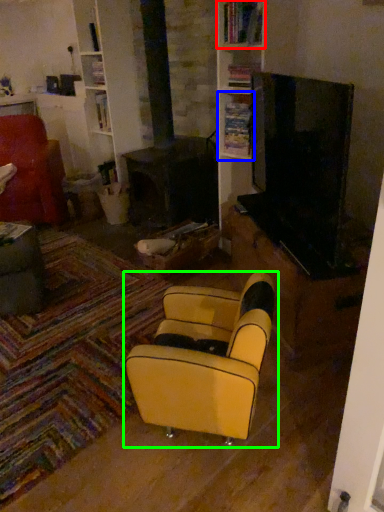
Question: Which object is the farthest from shelf (highlighted by a red box)? Choose among these: shelf (highlighted by a blue box) or chair (highlighted by a green box).

Choices:
 (A) shelf
 (B) chair

Answer: (B)